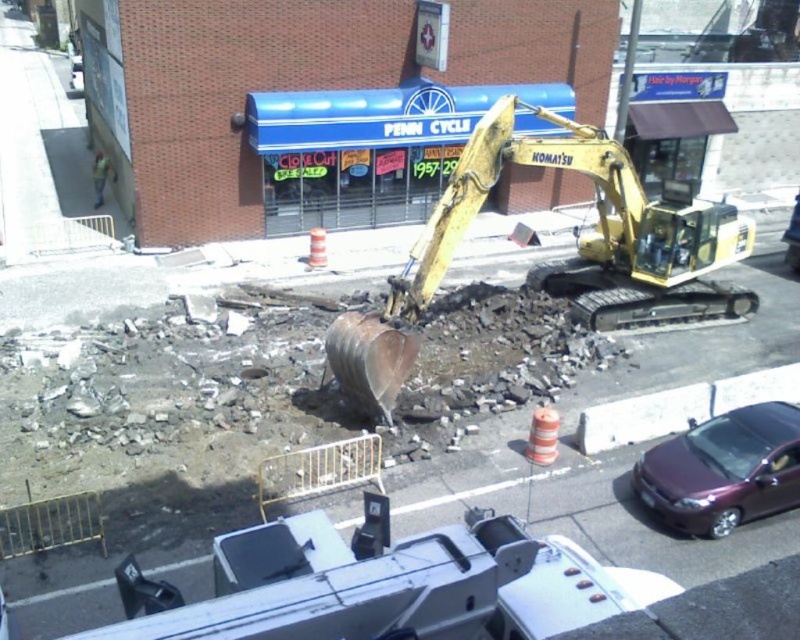
Question: Does yellow metallic excavator at center have a smaller size compared to blue awning at center?

Choices:
 (A) no
 (B) yes

Answer: (A)

Question: Which object is positioned closest to the metallic purple sedan at lower right?

Choices:
 (A) blue awning at center
 (B) yellow metallic excavator at center

Answer: (B)

Question: Can you confirm if yellow metallic excavator at center is smaller than blue awning at center?

Choices:
 (A) no
 (B) yes

Answer: (A)

Question: Among these points, which one is nearest to the camera?

Choices:
 (A) (538, 132)
 (B) (676, 508)
 (C) (96, 186)
 (D) (688, 198)

Answer: (B)

Question: Among these objects, which one is farthest from the camera?

Choices:
 (A) blue awning at center
 (B) yellow metallic excavator at center
 (C) metallic purple sedan at lower right

Answer: (A)

Question: Does yellow metallic excavator at center lie in front of blue awning at center?

Choices:
 (A) no
 (B) yes

Answer: (B)